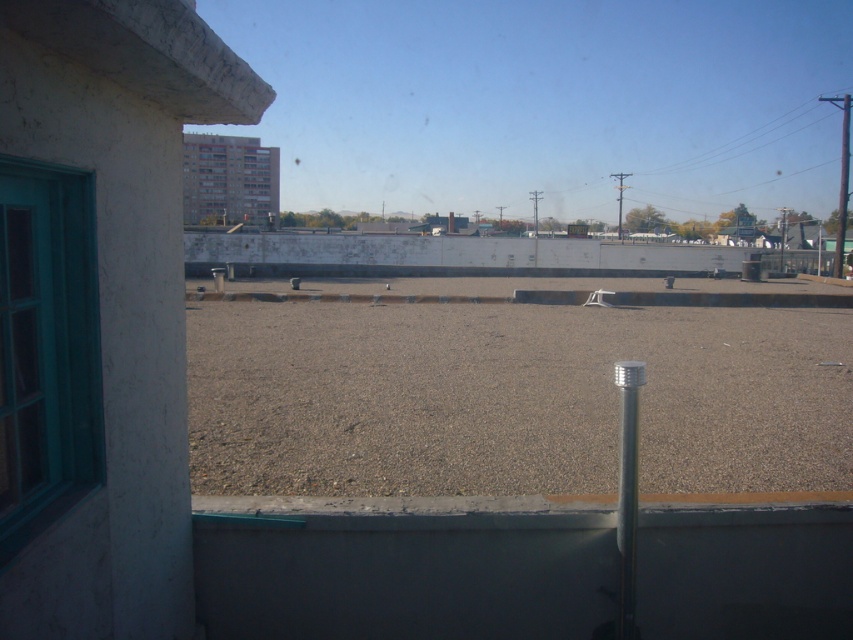
Does point (305, 333) lie in front of point (619, 596)?

That is False.

Locate an element on the screen. brown gravel at center is located at coordinates (512, 397).

Can you confirm if matte glass window at upper center is positioned to the right of silver metallic pole at center?

No, matte glass window at upper center is not to the right of silver metallic pole at center.

Which is in front, point (209, 148) or point (624, 397)?

Point (624, 397) is more forward.

Describe the element at coordinates (229, 179) in the screenshot. I see `matte glass window at upper center` at that location.

Where is `matte glass window at upper center`? The height and width of the screenshot is (640, 853). matte glass window at upper center is located at coordinates (229, 179).

Does metallic pole at right have a larger size compared to metallic pole at upper right?

Yes, metallic pole at right is bigger than metallic pole at upper right.

Does metallic pole at right have a smaller size compared to metallic pole at upper right?

No.

This screenshot has height=640, width=853. Find the location of `metallic pole at right`. metallic pole at right is located at coordinates (840, 180).